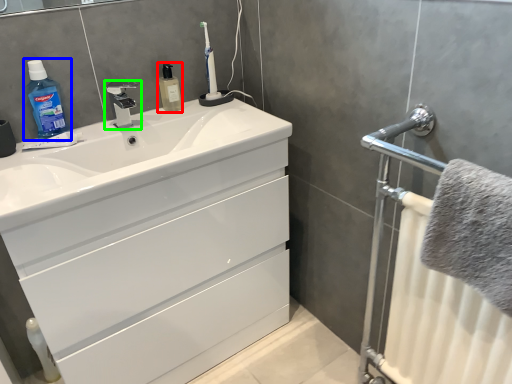
Question: Estimate the real-world distances between objects in this image. Which object is closer to mouthwash (highlighted by a red box), cleaning product (highlighted by a blue box) or tap (highlighted by a green box)?

Choices:
 (A) cleaning product
 (B) tap

Answer: (B)